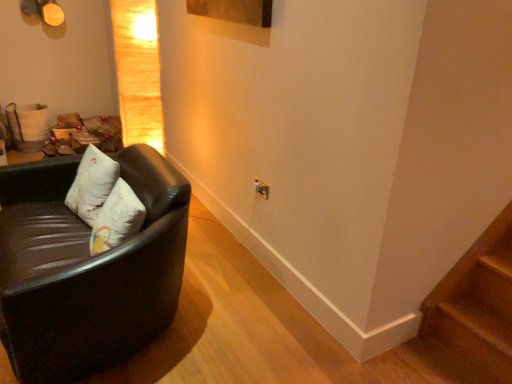
Question: From the image's perspective, is matte gold lampshade at upper left above wooden at lower right?

Choices:
 (A) no
 (B) yes

Answer: (B)

Question: Can you confirm if matte gold lampshade at upper left is shorter than wooden at lower right?

Choices:
 (A) yes
 (B) no

Answer: (B)

Question: From a real-world perspective, is matte gold lampshade at upper left on top of wooden at lower right?

Choices:
 (A) no
 (B) yes

Answer: (B)

Question: From a real-world perspective, is matte gold lampshade at upper left positioned under wooden at lower right based on gravity?

Choices:
 (A) yes
 (B) no

Answer: (B)

Question: Does matte gold lampshade at upper left turn towards wooden at lower right?

Choices:
 (A) no
 (B) yes

Answer: (A)

Question: In the image, is wooden at lower right positioned in front of or behind white soft pillow at left?

Choices:
 (A) front
 (B) behind

Answer: (A)

Question: Would you say wooden at lower right is inside or outside white soft pillow at left?

Choices:
 (A) outside
 (B) inside

Answer: (A)

Question: From a real-world perspective, is wooden at lower right physically located above or below white soft pillow at left?

Choices:
 (A) above
 (B) below

Answer: (B)

Question: From the image's perspective, relative to white soft pillow at left, is wooden at lower right above or below?

Choices:
 (A) above
 (B) below

Answer: (B)

Question: From the image's perspective, is matte gold lampshade at upper left above or below black leather couch at left?

Choices:
 (A) above
 (B) below

Answer: (A)

Question: Is matte gold lampshade at upper left taller or shorter than black leather couch at left?

Choices:
 (A) short
 (B) tall

Answer: (B)

Question: Looking at their shapes, would you say matte gold lampshade at upper left is wider or thinner than black leather couch at left?

Choices:
 (A) thin
 (B) wide

Answer: (A)

Question: From a real-world perspective, relative to black leather couch at left, is matte gold lampshade at upper left vertically above or below?

Choices:
 (A) above
 (B) below

Answer: (A)

Question: In terms of width, does matte gold lampshade at upper left look wider or thinner when compared to white soft pillow at left?

Choices:
 (A) wide
 (B) thin

Answer: (A)

Question: Considering the positions of matte gold lampshade at upper left and white soft pillow at left in the image, is matte gold lampshade at upper left taller or shorter than white soft pillow at left?

Choices:
 (A) short
 (B) tall

Answer: (B)